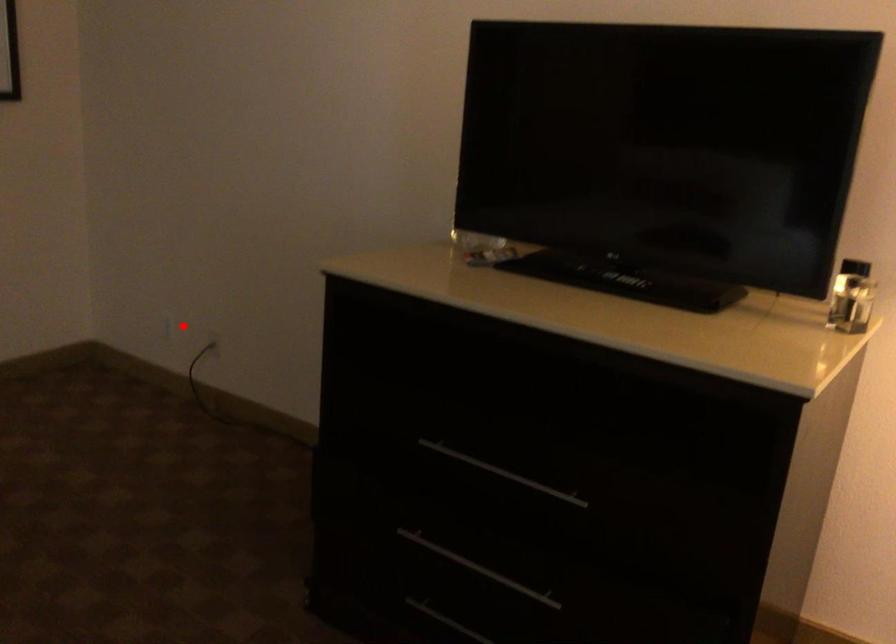
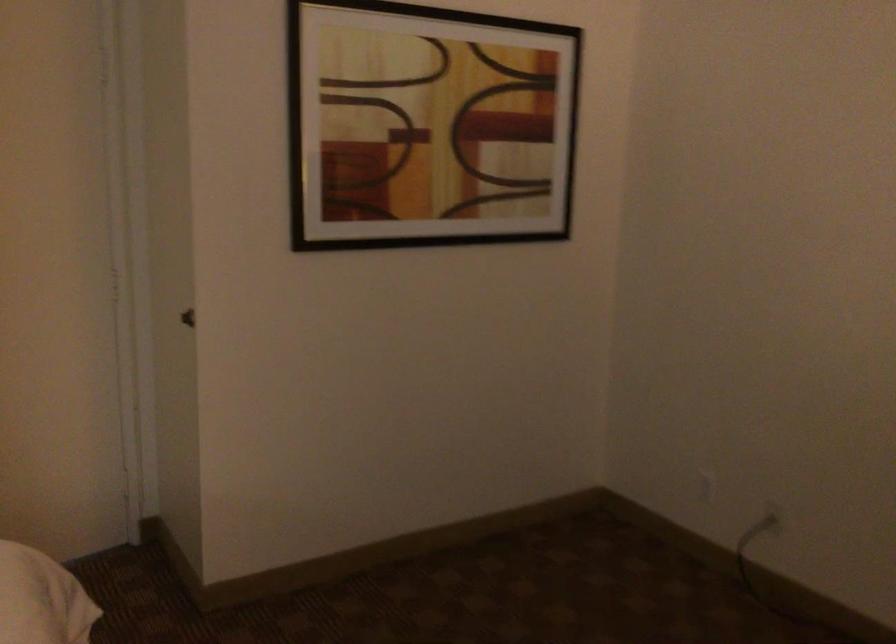
Question: I am providing you with two images of the same scene from different viewpoints. Given a red point in image1, look at the same physical point in image2. Is it:

Choices:
 (A) Closer to the viewpoint
 (B) Farther from the viewpoint

Answer: (A)